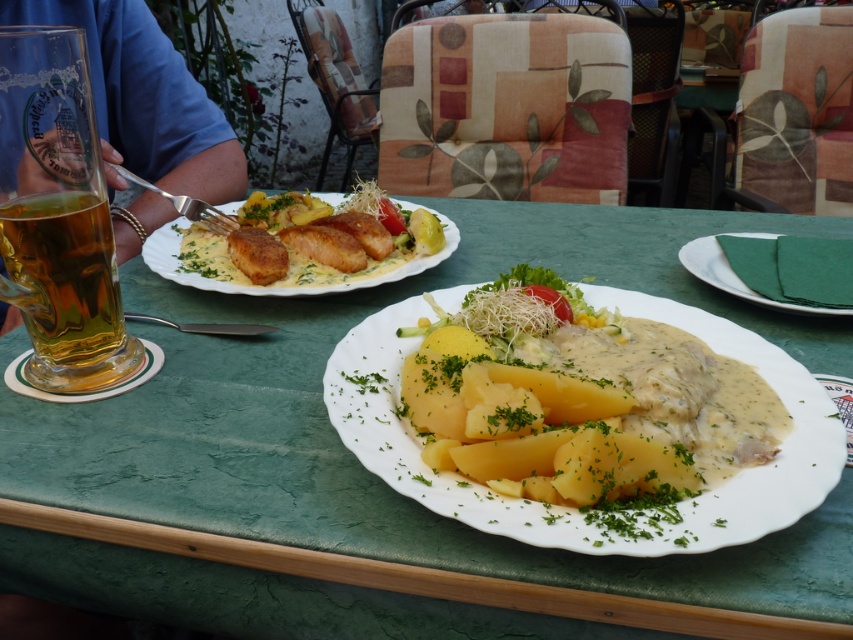
How distant is golden-brown crispy chicken at center from green paper napkin at right?

golden-brown crispy chicken at center and green paper napkin at right are 12.23 inches apart.

From the picture: Between golden-brown crispy chicken at center and green paper napkin at right, which one has more height?

golden-brown crispy chicken at center is taller.

This screenshot has width=853, height=640. Describe the element at coordinates (341, 272) in the screenshot. I see `golden-brown crispy chicken at center` at that location.

The height and width of the screenshot is (640, 853). Identify the location of golden-brown crispy chicken at center. (341, 272).

Does yellow matte potatoes at center have a greater width compared to green paper napkin at right?

Yes, yellow matte potatoes at center is wider than green paper napkin at right.

Is point (450, 364) closer to camera compared to point (775, 304)?

Yes, it is.

What do you see at coordinates (581, 403) in the screenshot? I see `yellow matte potatoes at center` at bounding box center [581, 403].

You are a GUI agent. You are given a task and a screenshot of the screen. Output one action in this format:
    pyautogui.click(x=<x>, y=<y>)
    Task: Click on the yellow matte potatoes at center
    This screenshot has height=640, width=853.
    Given the screenshot: What is the action you would take?
    pyautogui.click(x=581, y=403)

Can you confirm if yellow matte potatoes at center is shorter than golden-brown crispy chicken at center?

Indeed, yellow matte potatoes at center has a lesser height compared to golden-brown crispy chicken at center.

You are a GUI agent. You are given a task and a screenshot of the screen. Output one action in this format:
    pyautogui.click(x=<x>, y=<y>)
    Task: Click on the yellow matte potatoes at center
    
    Given the screenshot: What is the action you would take?
    pyautogui.click(x=581, y=403)